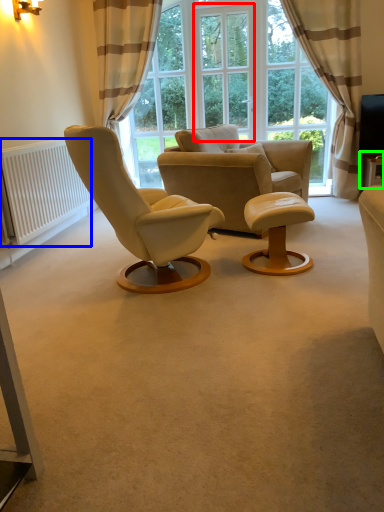
Question: Which is farther away from window screen (highlighted by a red box)? radiator (highlighted by a blue box) or round table (highlighted by a green box)?

Choices:
 (A) radiator
 (B) round table

Answer: (A)